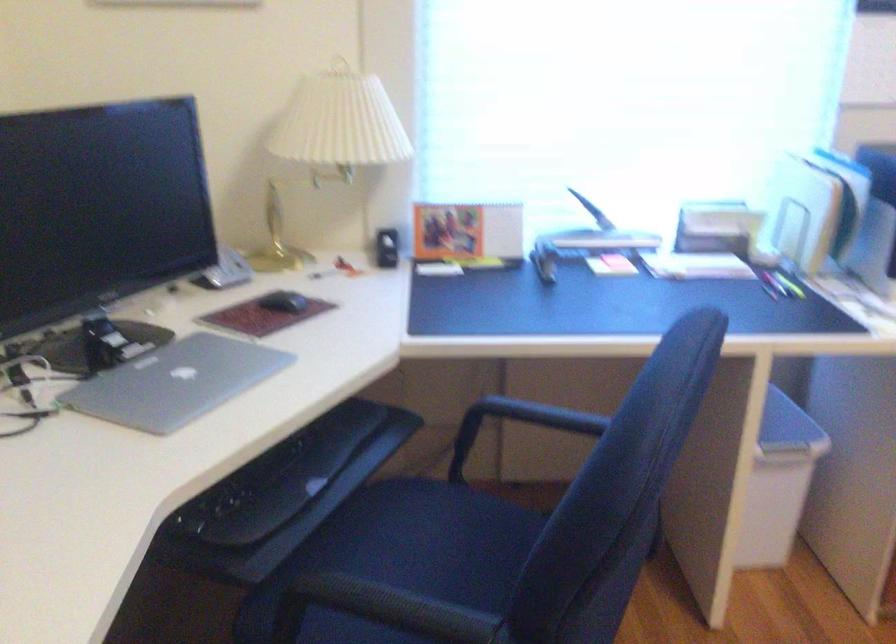
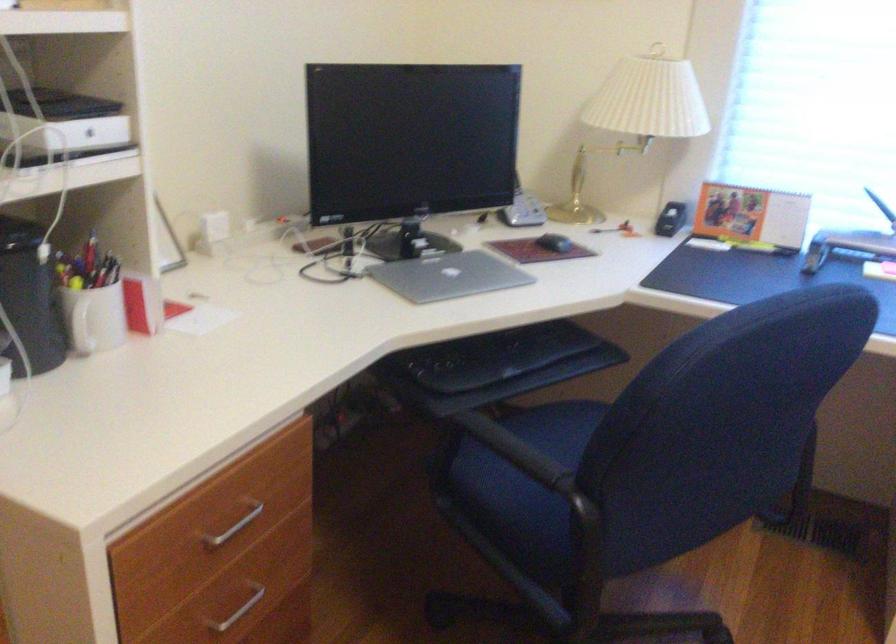
Locate, in the second image, the point that corresponds to point (186, 383) in the first image.

(449, 276)